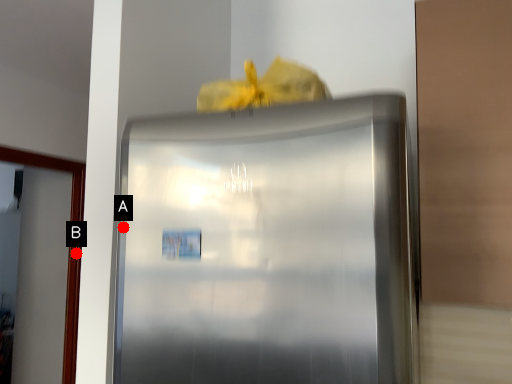
Question: Two points are circled on the image, labeled by A and B beside each circle. Among these points, which one is farthest from the camera?

Choices:
 (A) A is further
 (B) B is further

Answer: (B)